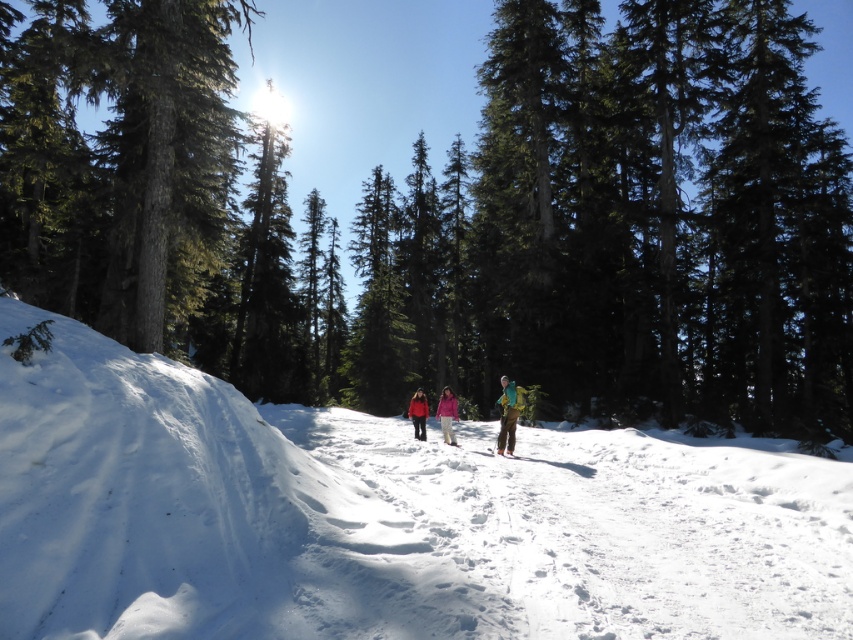
Consider the image. Who is lower down, white powdery snow at center or matte red jacket at center?

matte red jacket at center is below.

Does point (640, 595) lie behind point (415, 432)?

That is False.

Does point (766, 524) lie in front of point (415, 396)?

Yes.

In order to click on white powdery snow at center in this screenshot , I will do `click(386, 516)`.

Consider the image. Between pink fabric jacket at center and matte yellow ski at center, which one has more height?

pink fabric jacket at center is taller.

Can you confirm if pink fabric jacket at center is taller than matte yellow ski at center?

Indeed, pink fabric jacket at center has a greater height compared to matte yellow ski at center.

Where is `pink fabric jacket at center`? This screenshot has width=853, height=640. pink fabric jacket at center is located at coordinates (447, 413).

Does white snow at center have a larger size compared to matte red jacket at center?

Yes.

Which of these two, white snow at center or matte red jacket at center, stands shorter?

matte red jacket at center is shorter.

Is point (720, 481) positioned before point (421, 413)?

Yes, it is in front of point (421, 413).

Locate an element on the screen. This screenshot has height=640, width=853. white snow at center is located at coordinates (598, 529).